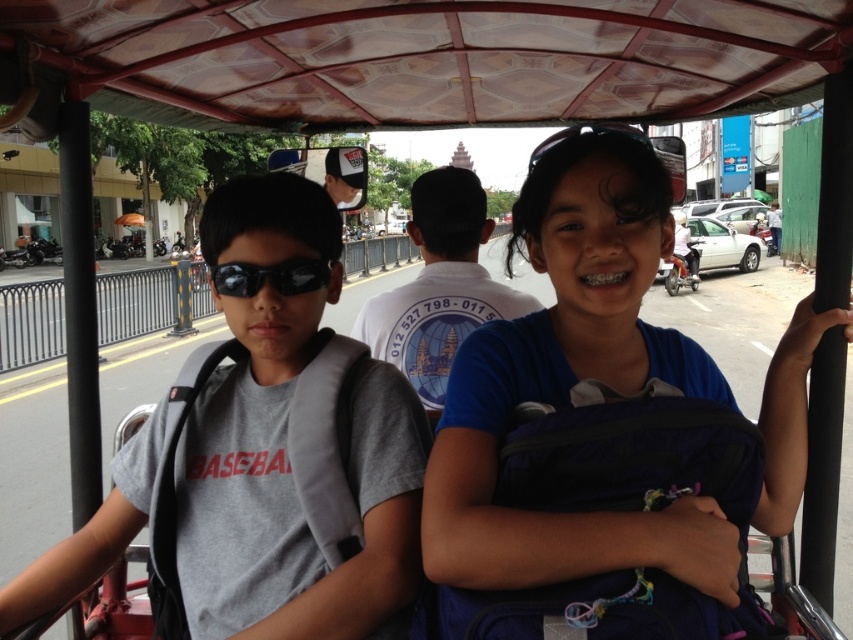
Question: Which point is closer to the camera?

Choices:
 (A) gray fabric backpack at left
 (B) black reflective sunglasses at left
 (C) black matte sunglasses at center

Answer: (A)

Question: Which of these objects is positioned farthest from the black matte sunglasses at center?

Choices:
 (A) blue fabric backpack at center
 (B) black reflective sunglasses at left

Answer: (B)

Question: Can you confirm if gray fabric backpack at left is wider than black reflective sunglasses at left?

Choices:
 (A) yes
 (B) no

Answer: (A)

Question: Does blue fabric backpack at center appear on the right side of black matte sunglasses at center?

Choices:
 (A) yes
 (B) no

Answer: (B)

Question: Which is nearer to the blue fabric backpack at center?

Choices:
 (A) gray fabric backpack at left
 (B) black matte sunglasses at center
 (C) black reflective sunglasses at left

Answer: (A)

Question: Is blue fabric backpack at center below black reflective sunglasses at left?

Choices:
 (A) yes
 (B) no

Answer: (A)